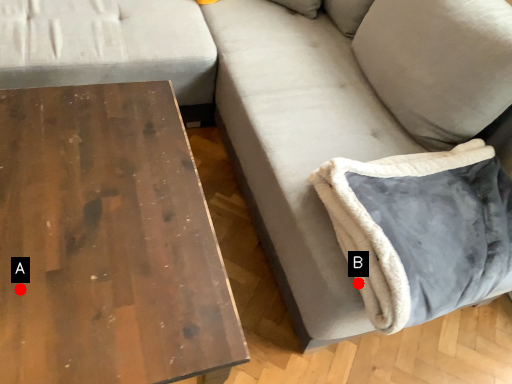
Question: Two points are circled on the image, labeled by A and B beside each circle. Which point appears farthest from the camera in this image?

Choices:
 (A) A is further
 (B) B is further

Answer: (B)